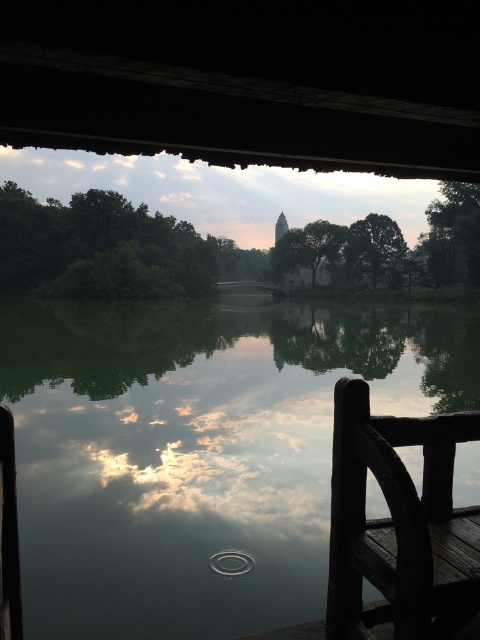
Which of these two, green reflective water at center or dark wood rail at lower right, stands taller?

green reflective water at center

I want to click on green reflective water at center, so click(x=197, y=449).

Is point (181, 330) farther from camera compared to point (357, 436)?

That is True.

You are a GUI agent. You are given a task and a screenshot of the screen. Output one action in this format:
    pyautogui.click(x=<x>, y=<y>)
    Task: Click on the green reflective water at center
    This screenshot has height=640, width=480.
    Given the screenshot: What is the action you would take?
    pyautogui.click(x=197, y=449)